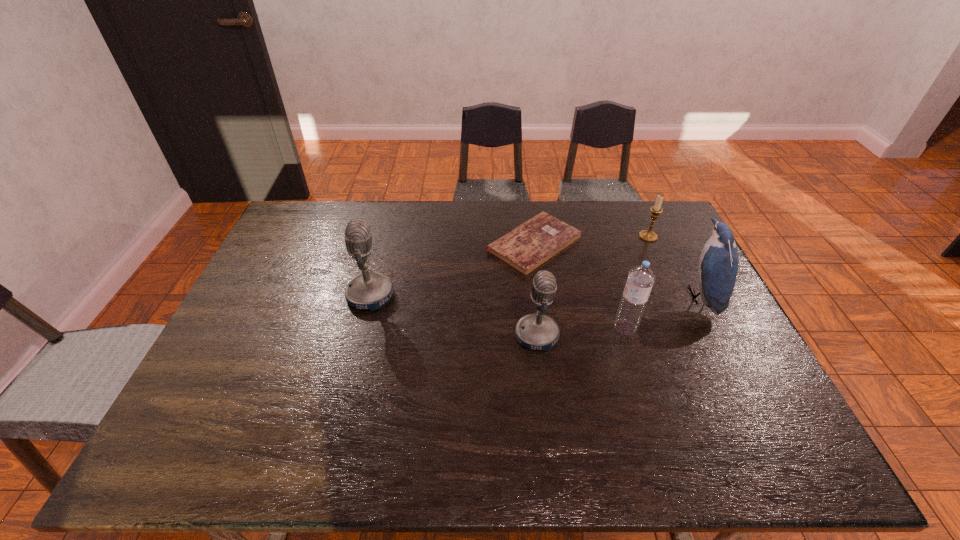
What are the coordinates of `free space located 0.290m on the front-facing side of the nearer microphone` in the screenshot? It's located at (664, 335).

You are a GUI agent. You are given a task and a screenshot of the screen. Output one action in this format:
    pyautogui.click(x=<x>, y=<y>)
    Task: Click on the free location located 0.290m on the left of the fifth tallest object
    The image size is (960, 540).
    Given the screenshot: What is the action you would take?
    pyautogui.click(x=556, y=237)

This screenshot has height=540, width=960. I want to click on vacant space situated 0.210m on the left of the Bible, so tap(424, 244).

The image size is (960, 540). I want to click on vacant space located 0.340m at the tip of the rightmost object's beak, so click(x=572, y=296).

This screenshot has height=540, width=960. Find the location of `free space located 0.130m at the tip of the rightmost object's beak`. free space located 0.130m at the tip of the rightmost object's beak is located at coordinates (642, 296).

This screenshot has height=540, width=960. I want to click on vacant area situated 0.370m at the tip of the rightmost object's beak, so click(563, 296).

Where is `free space located 0.180m on the front of the third object from right to left`? This screenshot has height=540, width=960. free space located 0.180m on the front of the third object from right to left is located at coordinates (646, 394).

Locate an element on the screen. The image size is (960, 540). candle holder located in the far edge section of the desktop is located at coordinates (648, 235).

Where is `Bible at the far edge`? Bible at the far edge is located at coordinates (525, 248).

Locate an element on the screen. candle holder at the right edge is located at coordinates (648, 235).